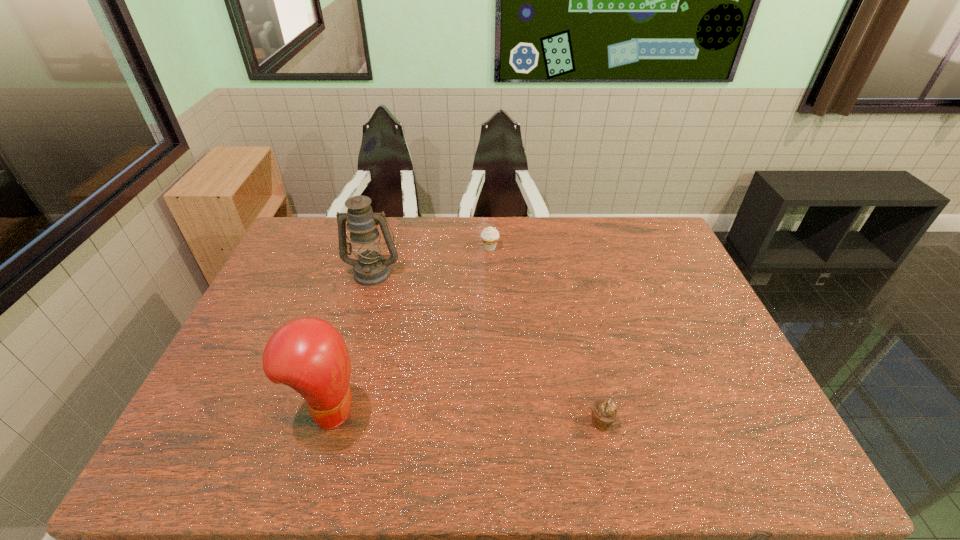
Where is `the second farthest object`? The width and height of the screenshot is (960, 540). the second farthest object is located at coordinates (371, 268).

Where is `boxing glove`? This screenshot has height=540, width=960. boxing glove is located at coordinates (308, 354).

You are a GUI agent. You are given a task and a screenshot of the screen. Output one action in this format:
    pyautogui.click(x=<x>, y=<y>)
    Task: Click on the left muffin
    Image resolution: width=960 pixels, height=540 pixels.
    Given the screenshot: What is the action you would take?
    pyautogui.click(x=490, y=236)

At what (x,y) coordinates should I click in order to perform the action: click on the third object from left to right. Please return your answer as a coordinate pair (x, y). The width and height of the screenshot is (960, 540). Looking at the image, I should click on (490, 236).

Identify the location of the right muffin. (604, 413).

The image size is (960, 540). Find the location of `the rightmost object`. the rightmost object is located at coordinates (604, 413).

This screenshot has height=540, width=960. I want to click on vacant space situated on the left of the third nearest object, so click(x=308, y=273).

Locate an element on the screen. The height and width of the screenshot is (540, 960). vacant region located 0.260m on the striking surface of the boxing glove is located at coordinates (470, 409).

Locate an element on the screen. The height and width of the screenshot is (540, 960). free location located on the right of the left muffin is located at coordinates (544, 247).

The height and width of the screenshot is (540, 960). I want to click on vacant position located on the back of the nearer muffin, so click(580, 328).